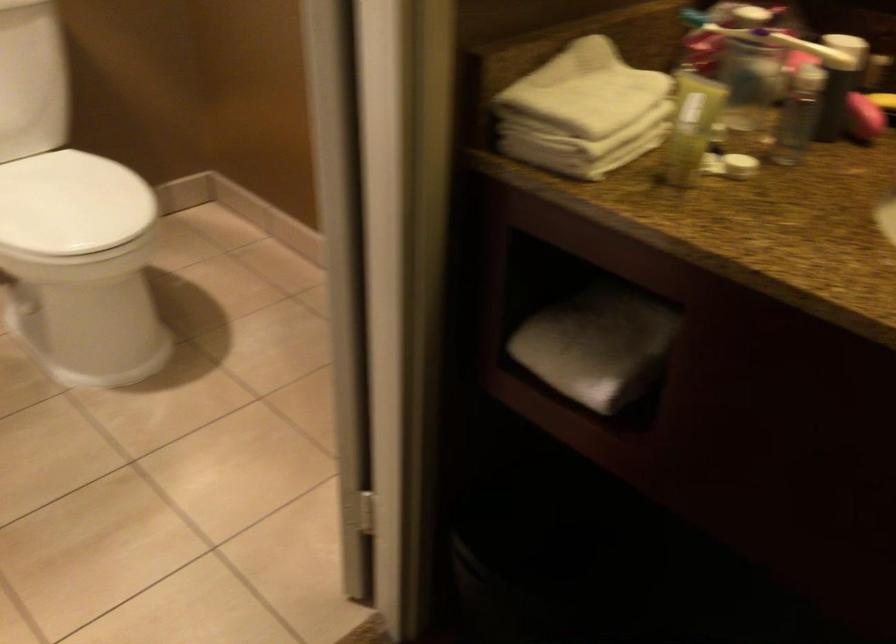
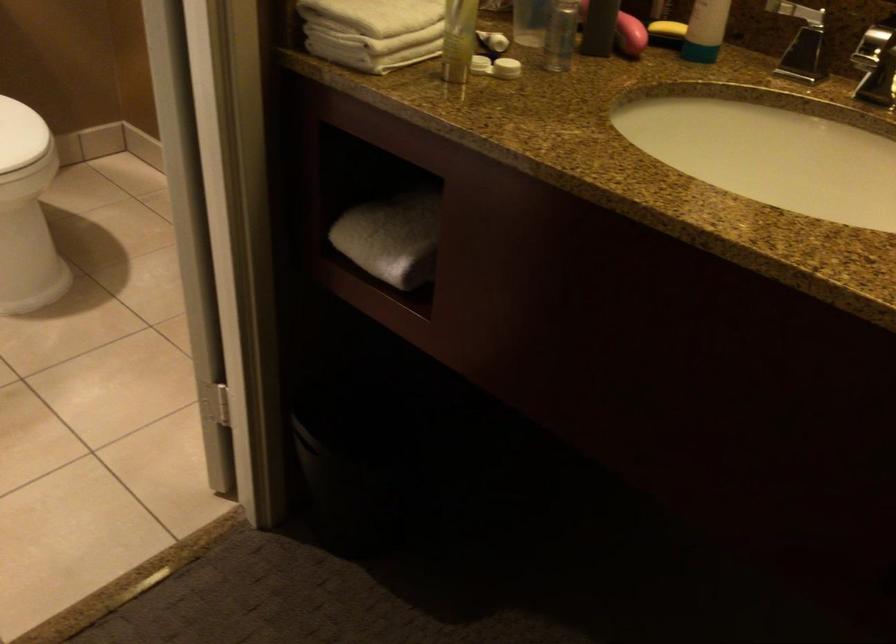
Locate, in the second image, the point that corresponds to (x=590, y=107) in the first image.

(380, 14)